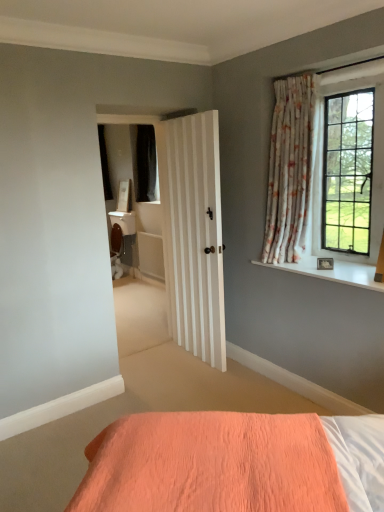
The width and height of the screenshot is (384, 512). In order to click on free space above white smooth window sill at upper right (from a real-world perspective) in this screenshot , I will do `click(329, 264)`.